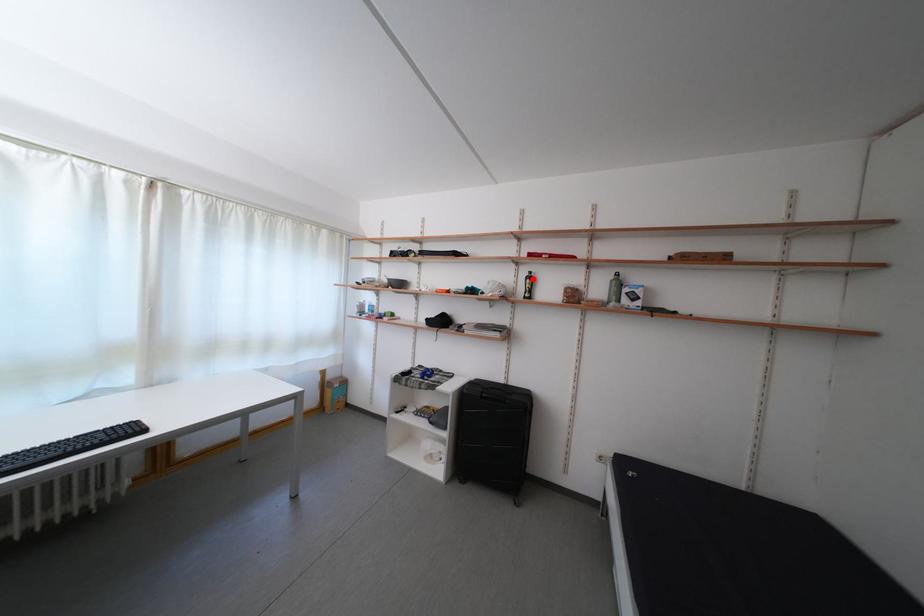
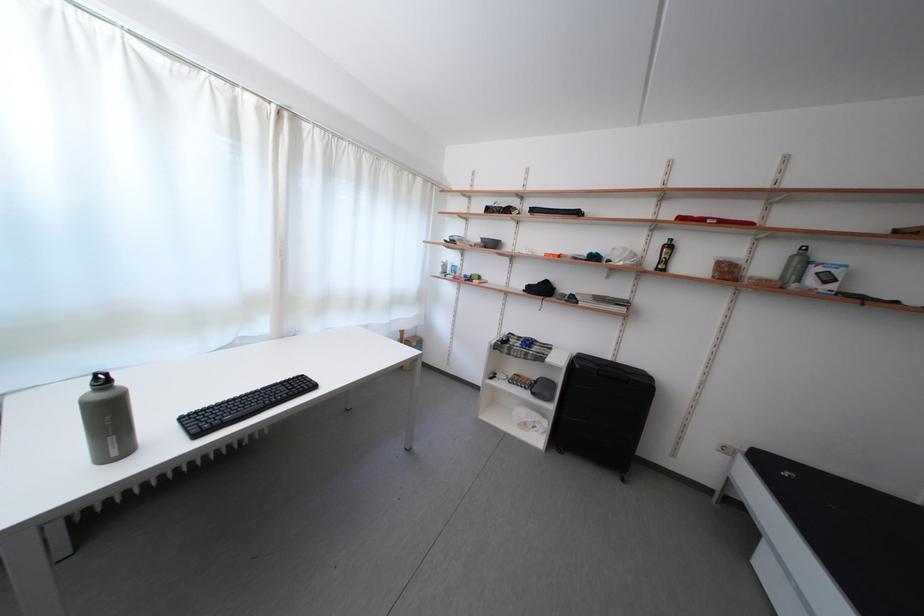
Locate, in the second image, the point that corresponds to the highlighted location in the first image.

(669, 246)